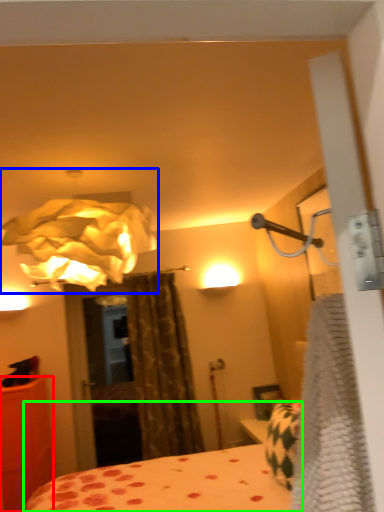
Question: Which object is positioned closest to furniture (highlighted by a red box)? Select from lamp (highlighted by a blue box) and bed (highlighted by a green box).

Choices:
 (A) lamp
 (B) bed

Answer: (B)